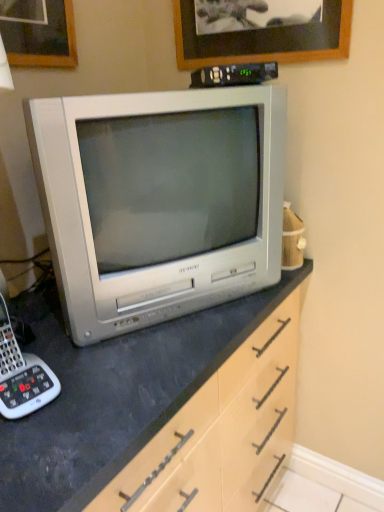
Question: Considering the relative sizes of black plastic remote control at upper center and wooden picture frame at upper center in the image provided, is black plastic remote control at upper center smaller than wooden picture frame at upper center?

Choices:
 (A) yes
 (B) no

Answer: (A)

Question: From a real-world perspective, is black plastic remote control at upper center under wooden picture frame at upper center?

Choices:
 (A) yes
 (B) no

Answer: (A)

Question: Is black plastic remote control at upper center aimed at wooden picture frame at upper center?

Choices:
 (A) no
 (B) yes

Answer: (A)

Question: From the image's perspective, does black plastic remote control at upper center appear lower than wooden picture frame at upper center?

Choices:
 (A) no
 (B) yes

Answer: (B)

Question: Can you confirm if black plastic remote control at upper center is taller than wooden picture frame at upper center?

Choices:
 (A) no
 (B) yes

Answer: (A)

Question: From a real-world perspective, is white plastic corded phone at lower left above or below wooden picture frame at upper center?

Choices:
 (A) above
 (B) below

Answer: (B)

Question: Visually, is white plastic corded phone at lower left positioned to the left or to the right of wooden picture frame at upper center?

Choices:
 (A) right
 (B) left

Answer: (B)

Question: Is white plastic corded phone at lower left taller or shorter than wooden picture frame at upper center?

Choices:
 (A) tall
 (B) short

Answer: (B)

Question: Is white plastic corded phone at lower left inside the boundaries of wooden picture frame at upper center, or outside?

Choices:
 (A) inside
 (B) outside

Answer: (B)

Question: Is white plastic corded phone at lower left wider or thinner than silver metallic television at center?

Choices:
 (A) thin
 (B) wide

Answer: (A)

Question: From the image's perspective, is white plastic corded phone at lower left above or below silver metallic television at center?

Choices:
 (A) below
 (B) above

Answer: (A)

Question: Relative to silver metallic television at center, is white plastic corded phone at lower left in front or behind?

Choices:
 (A) front
 (B) behind

Answer: (A)

Question: From a real-world perspective, is white plastic corded phone at lower left positioned above or below silver metallic television at center?

Choices:
 (A) above
 (B) below

Answer: (B)

Question: Is silver metallic television at center inside or outside of wooden picture frame at upper center?

Choices:
 (A) outside
 (B) inside

Answer: (A)

Question: Is silver metallic television at center wider or thinner than wooden picture frame at upper center?

Choices:
 (A) wide
 (B) thin

Answer: (A)